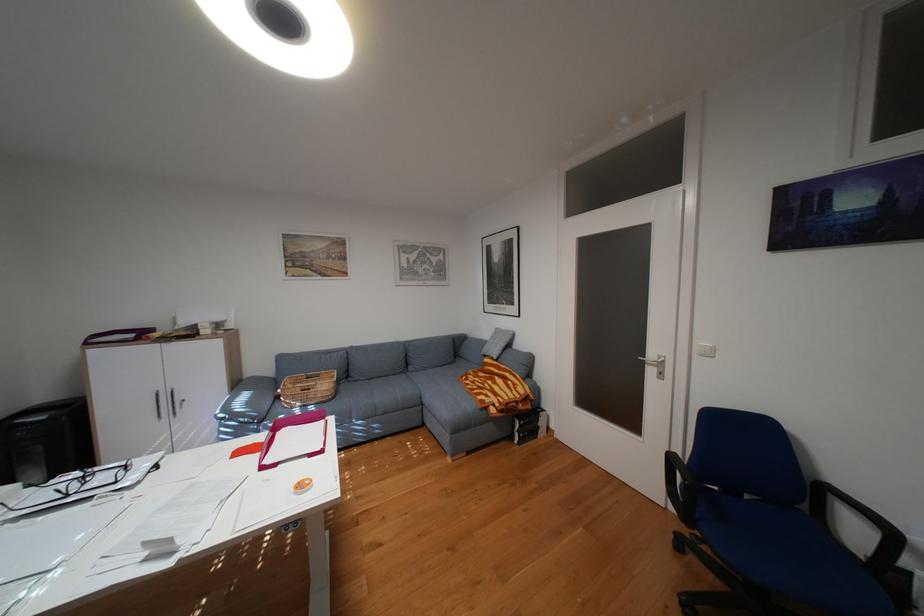
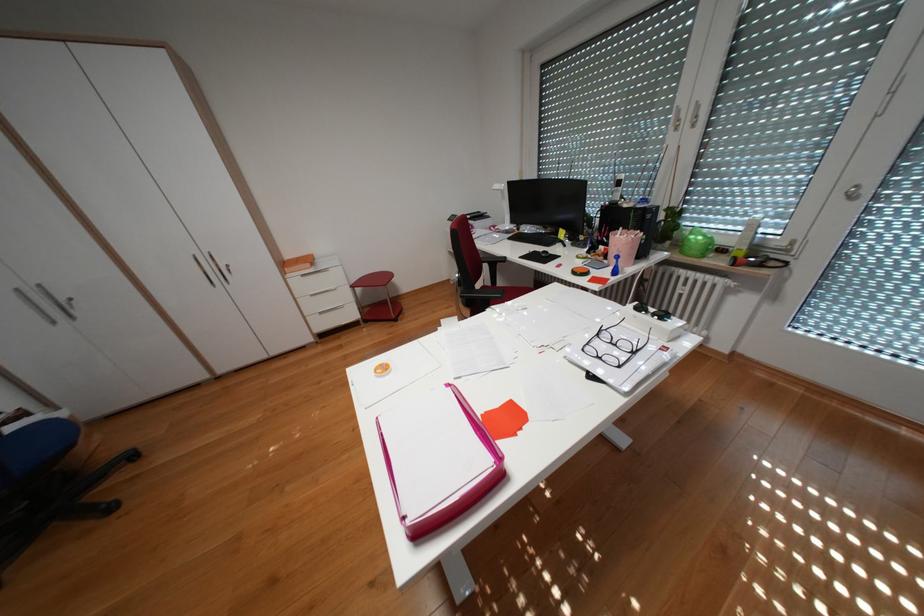
Locate, in the second image, the point that corresponds to point (79, 495) in the first image.

(610, 334)